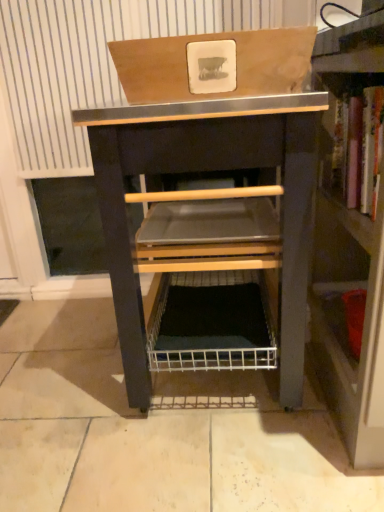
At what (x,y) coordinates should I click in order to perform the action: click on black metal/wooden vanity at center. Please return your answer as a coordinate pair (x, y). This screenshot has height=512, width=384. Looking at the image, I should click on (208, 170).

What are the coordinates of `wooden box at upper center` in the screenshot? It's located at (236, 65).

Looking at this image, is wooden box at upper center looking in the opposite direction of wooden bookshelf at right?

Absolutely, wooden box at upper center is directed away from wooden bookshelf at right.

Is wooden box at upper center directly adjacent to wooden bookshelf at right?

No, wooden box at upper center is not next to wooden bookshelf at right.

Is point (176, 98) closer to viewer compared to point (372, 354)?

No, it is not.

From the picture: What's the angular difference between wooden box at upper center and wooden bookshelf at right's facing directions?

There is a 90.9-degree angle between the facing directions of wooden box at upper center and wooden bookshelf at right.

The image size is (384, 512). I want to click on vanity on the left of wooden bookshelf at right, so [x=208, y=170].

From a real-world perspective, is black metal/wooden vanity at center on wooden bookshelf at right?

Incorrect, from a real-world perspective, black metal/wooden vanity at center is lower than wooden bookshelf at right.

Is black metal/wooden vanity at center taller or shorter than wooden bookshelf at right?

black metal/wooden vanity at center is shorter than wooden bookshelf at right.

Looking at the image, does black metal/wooden vanity at center seem bigger or smaller compared to wooden bookshelf at right?

Considering their sizes, black metal/wooden vanity at center takes up more space than wooden bookshelf at right.

Considering the sizes of objects wooden box at upper center and black metal/wooden vanity at center in the image provided, who is taller, wooden box at upper center or black metal/wooden vanity at center?

black metal/wooden vanity at center.

Consider the image. Is wooden box at upper center in front of black metal/wooden vanity at center?

Yes.

Identify the location of vanity below the wooden box at upper center (from a real-world perspective). This screenshot has height=512, width=384. pos(208,170).

Considering the positions of point (171, 78) and point (174, 146), is point (171, 78) closer or farther from the camera than point (174, 146)?

Point (171, 78) is closer to the camera than point (174, 146).

From the picture: From a real-world perspective, is wooden bookshelf at right above or below wooden box at upper center?

Clearly, from a real-world perspective, wooden bookshelf at right is below wooden box at upper center.

Between wooden bookshelf at right and wooden box at upper center, which one has larger width?

With larger width is wooden bookshelf at right.

Is wooden bookshelf at right oriented towards wooden box at upper center?

No, wooden bookshelf at right does not turn towards wooden box at upper center.

Which of these two, wooden bookshelf at right or wooden box at upper center, is bigger?

wooden bookshelf at right is bigger.

Which is in front, point (109, 184) or point (272, 42)?

Positioned in front is point (272, 42).

Which object is closer to the camera, black metal/wooden vanity at center or wooden box at upper center?

Positioned in front is wooden box at upper center.

Is black metal/wooden vanity at center placed right next to wooden box at upper center?

They are not placed beside each other.

Is wooden bookshelf at right facing away from black metal/wooden vanity at center?

wooden bookshelf at right does not have its back to black metal/wooden vanity at center.

Is wooden bookshelf at right far from black metal/wooden vanity at center?

Actually, wooden bookshelf at right and black metal/wooden vanity at center are a little close together.

In terms of height, does wooden bookshelf at right look taller or shorter compared to black metal/wooden vanity at center?

Considering their sizes, wooden bookshelf at right has more height than black metal/wooden vanity at center.

The image size is (384, 512). I want to click on cardboard box above the wooden bookshelf at right (from the image's perspective), so click(x=236, y=65).

Find the location of `vanity on the left of wooden bookshelf at right`. vanity on the left of wooden bookshelf at right is located at coordinates (208, 170).

When comparing their distances from wooden box at upper center, does wooden bookshelf at right or black metal/wooden vanity at center seem further?

wooden bookshelf at right is positioned further to the anchor wooden box at upper center.

Considering their positions, is black metal/wooden vanity at center positioned closer to wooden box at upper center than wooden bookshelf at right?

Among the two, black metal/wooden vanity at center is located nearer to wooden box at upper center.

When comparing their distances from wooden bookshelf at right, does black metal/wooden vanity at center or wooden box at upper center seem further?

wooden box at upper center lies further to wooden bookshelf at right than the other object.

Which object lies further to the anchor point wooden bookshelf at right, wooden box at upper center or black metal/wooden vanity at center?

Based on the image, wooden box at upper center appears to be further to wooden bookshelf at right.

Considering their positions, is wooden box at upper center positioned closer to black metal/wooden vanity at center than wooden bookshelf at right?

wooden box at upper center is positioned closer to the anchor black metal/wooden vanity at center.

Based on their spatial positions, is wooden bookshelf at right or wooden box at upper center closer to black metal/wooden vanity at center?

wooden box at upper center lies closer to black metal/wooden vanity at center than the other object.

This screenshot has height=512, width=384. What are the coordinates of `vanity located between wooden box at upper center and wooden bookshelf at right in the left-right direction` in the screenshot? It's located at (208, 170).